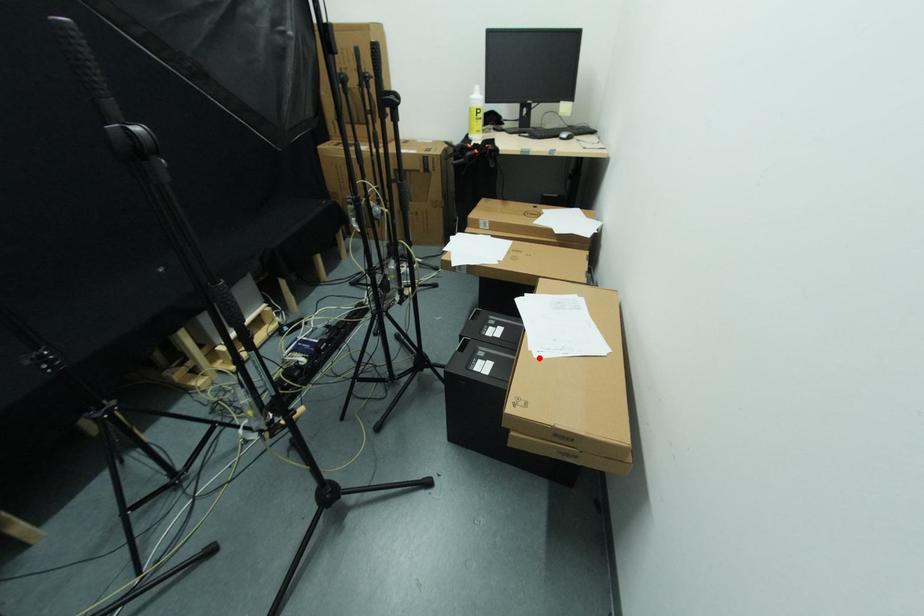
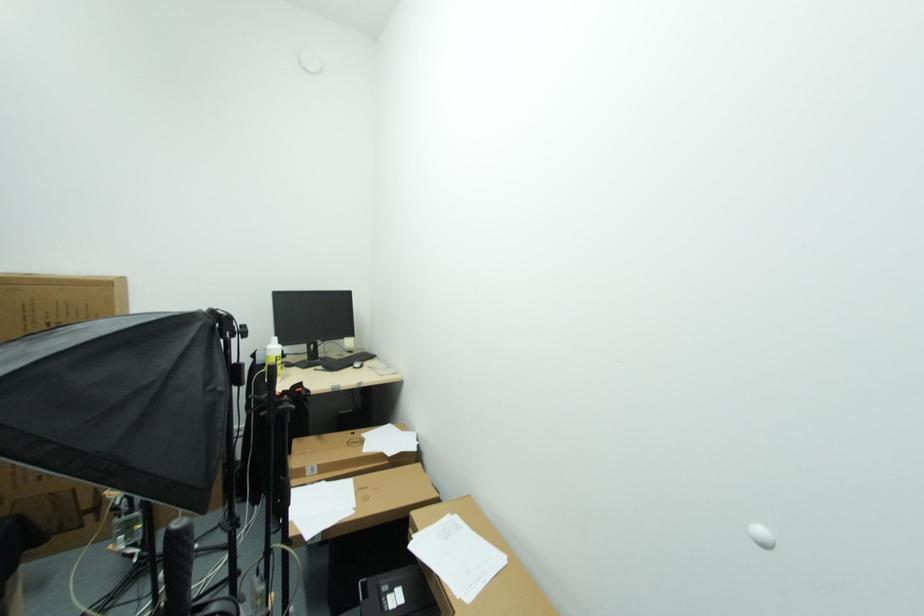
The point at the highlighted location is marked in the first image. Where is the corresponding point in the second image?

(470, 602)